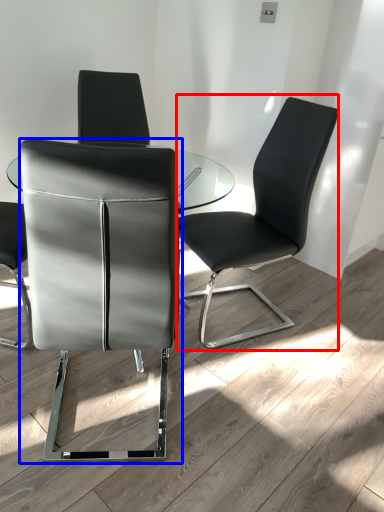
Question: Which object is further to the camera taking this photo, chair (highlighted by a red box) or chair (highlighted by a blue box)?

Choices:
 (A) chair
 (B) chair

Answer: (A)